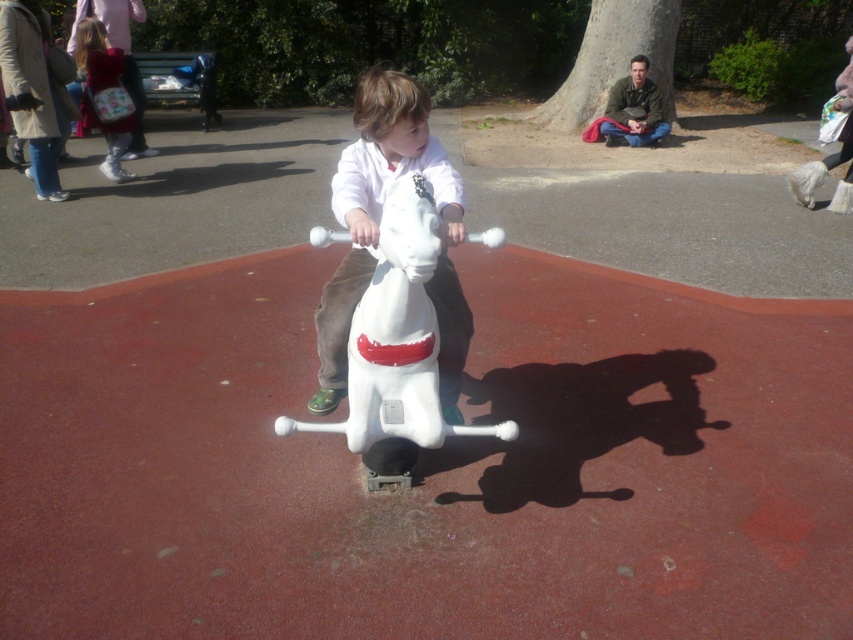
Consider the image. You are standing at the origin point of the coordinate system. The playground has a coordinate grid where the bottom left corner is the origin. The white plastic horse at center is at point (396,348). If you want to walk directly to the white plastic horse at center, in which direction should you move?

To reach the white plastic horse at center located at point (396,348) from the origin, you should move northeast because the coordinates are both positive, indicating movement to the right and upwards.

You are a photographer trying to capture a clear photo of the white plastic horse at center and the white matte horse at center. Since they are both white, you want to know their positions to frame them properly. Which horse is on the left side?

The white plastic horse at center is positioned on the right side of white matte horse at center, so the white matte horse at center is on the left side.